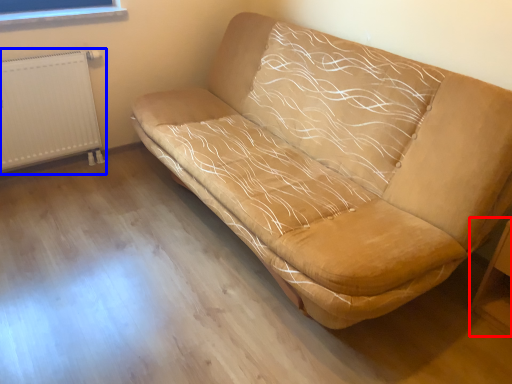
Question: Which object is further to the camera taking this photo, table (highlighted by a red box) or radiator (highlighted by a blue box)?

Choices:
 (A) table
 (B) radiator

Answer: (B)